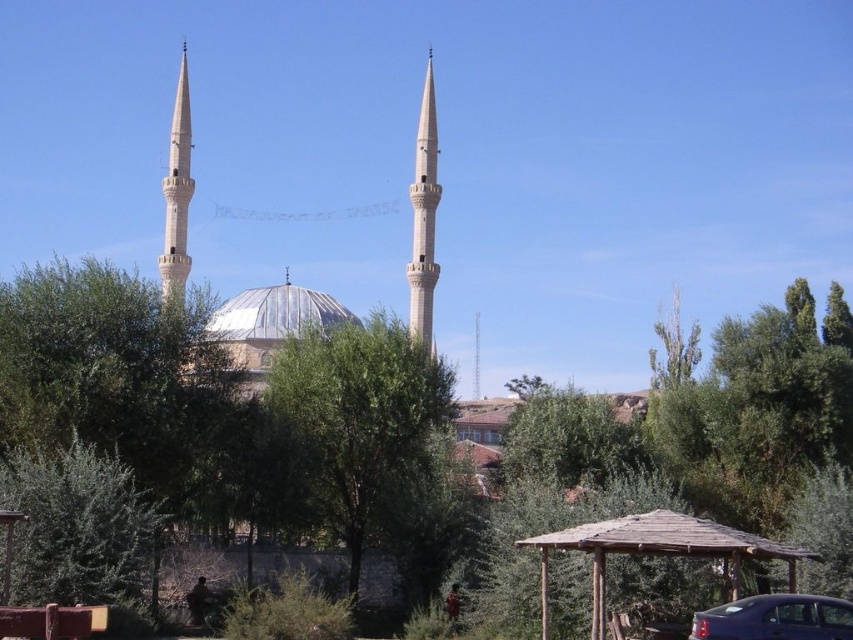
Question: Is green leafy tree at lower left thinner than metallic silver dome at center?

Choices:
 (A) yes
 (B) no

Answer: (A)

Question: Can you confirm if green leafy tree at center is positioned to the right of metallic blue sedan at lower right?

Choices:
 (A) yes
 (B) no

Answer: (B)

Question: Which is farther from the metallic blue sedan at lower right?

Choices:
 (A) metallic silver dome at center
 (B) green leafy tree at lower left

Answer: (B)

Question: Which object appears farthest from the camera in this image?

Choices:
 (A) metallic silver dome at center
 (B) green leafy tree at center

Answer: (A)

Question: Which of these objects is positioned closest to the green leafy tree at lower left?

Choices:
 (A) green leafy tree at center
 (B) metallic blue sedan at lower right

Answer: (A)

Question: Observing the image, what is the correct spatial positioning of green leafy tree at center in reference to metallic silver dome at center?

Choices:
 (A) above
 (B) below

Answer: (B)